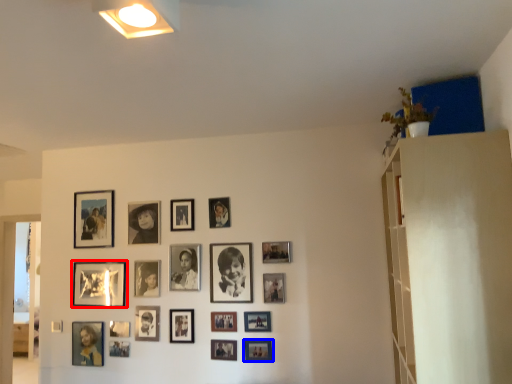
Question: Among these objects, which one is nearest to the camera, picture frame (highlighted by a red box) or picture frame (highlighted by a blue box)?

Choices:
 (A) picture frame
 (B) picture frame

Answer: (B)